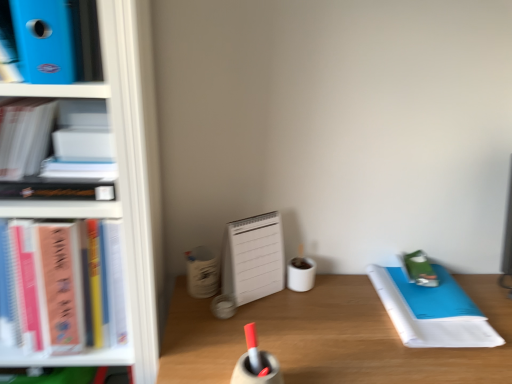
Question: Can you confirm if white matte book at upper left, which appears as the second book when ordered from the bottom, is shorter than blue plastic folder at upper left, placed as the 1th book when sorted from top to bottom?

Choices:
 (A) no
 (B) yes

Answer: (A)

Question: Can you confirm if white matte book at upper left, which appears as the second book when ordered from the bottom, is taller than blue plastic folder at upper left, placed as the 1th book when sorted from top to bottom?

Choices:
 (A) no
 (B) yes

Answer: (B)

Question: From a real-world perspective, is white matte book at upper left, which appears as the second book when ordered from the bottom, located beneath blue plastic folder at upper left, placed as the 1th book when sorted from top to bottom?

Choices:
 (A) yes
 (B) no

Answer: (A)

Question: From the image's perspective, is white matte book at upper left, the second book positioned from the top, located beneath blue plastic folder at upper left, placed as the 1th book when sorted from top to bottom?

Choices:
 (A) no
 (B) yes

Answer: (B)

Question: Is white matte book at upper left, which appears as the second book when ordered from the bottom, to the right of blue plastic folder at upper left, the third book positioned from the bottom, from the viewer's perspective?

Choices:
 (A) yes
 (B) no

Answer: (B)

Question: Can you confirm if white matte book at upper left, which appears as the second book when ordered from the bottom, is bigger than blue plastic folder at upper left, placed as the 1th book when sorted from top to bottom?

Choices:
 (A) no
 (B) yes

Answer: (B)

Question: Considering the relative sizes of green matte notebook at right and white paper notebook at right in the image provided, is green matte notebook at right wider than white paper notebook at right?

Choices:
 (A) no
 (B) yes

Answer: (A)

Question: Could you tell me if green matte notebook at right is facing white paper notebook at right?

Choices:
 (A) yes
 (B) no

Answer: (B)

Question: Is green matte notebook at right positioned in front of white paper notebook at right?

Choices:
 (A) no
 (B) yes

Answer: (A)

Question: Does green matte notebook at right have a lesser width compared to white paper notebook at right?

Choices:
 (A) no
 (B) yes

Answer: (B)

Question: Does green matte notebook at right appear on the left side of white paper notebook at right?

Choices:
 (A) yes
 (B) no

Answer: (B)

Question: From the image's perspective, is green matte notebook at right beneath white paper notebook at right?

Choices:
 (A) no
 (B) yes

Answer: (A)

Question: Is wooden desk at center positioned behind white paper notebook at right?

Choices:
 (A) yes
 (B) no

Answer: (B)